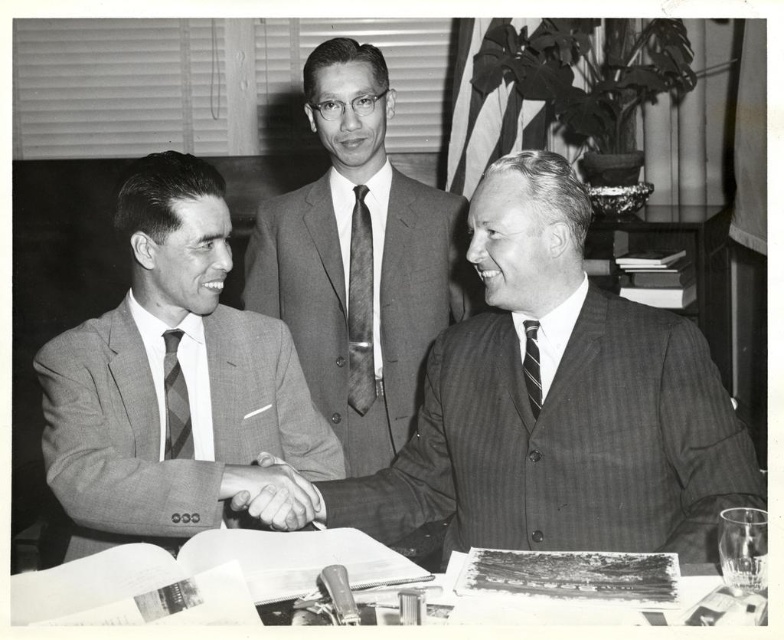
Is pinstriped suit at center thinner than gray striped tie at left?

No, pinstriped suit at center is not thinner than gray striped tie at left.

Which is in front, point (666, 417) or point (164, 337)?

Point (666, 417)

Between point (583, 515) and point (169, 328), which one is positioned behind?

The point (169, 328) is behind.

I want to click on pinstriped suit at center, so click(x=557, y=403).

Which is behind, point (554, 492) or point (356, 346)?

The point (356, 346) is more distant.

The height and width of the screenshot is (640, 784). What do you see at coordinates (557, 403) in the screenshot?
I see `pinstriped suit at center` at bounding box center [557, 403].

Locate an element on the screen. This screenshot has height=640, width=784. pinstriped suit at center is located at coordinates (557, 403).

Is textured gray tie at center to the left of gray striped tie at left from the viewer's perspective?

No, textured gray tie at center is not to the left of gray striped tie at left.

Looking at this image, who is shorter, textured gray tie at center or gray striped tie at left?

gray striped tie at left

The image size is (784, 640). What do you see at coordinates (360, 307) in the screenshot?
I see `textured gray tie at center` at bounding box center [360, 307].

Locate an element on the screen. The width and height of the screenshot is (784, 640). textured gray tie at center is located at coordinates click(x=360, y=307).